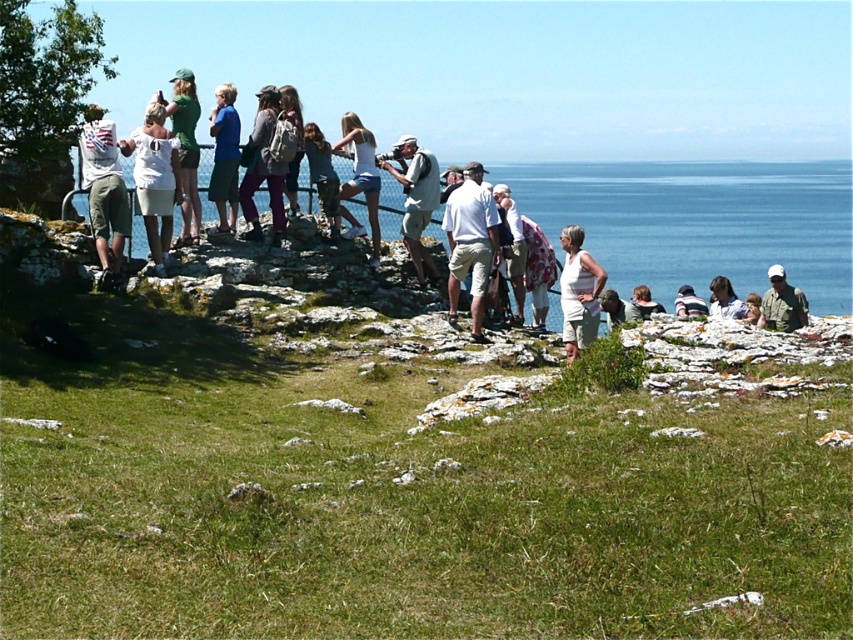
You are standing at the scenic overlook and want to place a small flag at the point closer to the camera between point (383,156) and point (294,193). Which point should you choose?

Point (383,156) is further to the camera than point (294,193), so you should choose point (294,193) as it is closer to the camera.

You are standing at the scenic overlook and want to reach the point marked as point (422,161). If your walking speed is 1.2 meters per second, how many seconds will it take you to reach that point?

The point (422,161) is 15.59 meters away from the viewer. At a walking speed of 1.2 meters per second, it will take approximately 13 seconds to reach the point.

You are standing at the scenic overlook and want to take a photo of the blue cotton shirt at center. Where should you position yourself to capture the shirt in the frame?

The blue cotton shirt at center is located at point (224, 156), so position yourself at that coordinate to capture it in the frame.